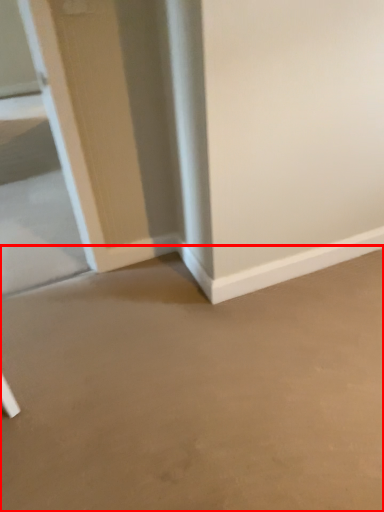
Question: Where is concrete (annotated by the red box) located in relation to glass door in the image?

Choices:
 (A) left
 (B) right

Answer: (B)